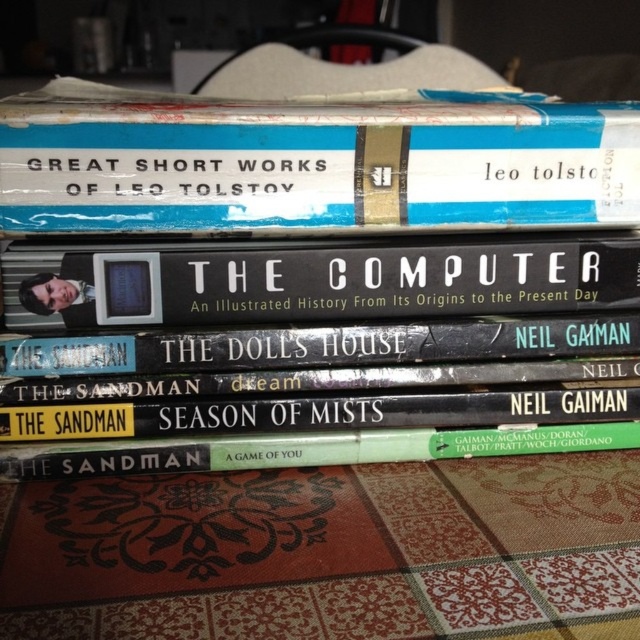
Question: Among these points, which one is nearest to the camera?

Choices:
 (A) (83, 145)
 (B) (376, 298)
 (C) (612, 237)

Answer: (A)

Question: Can you confirm if blue hardcover book at upper center is bigger than green matte book at center?

Choices:
 (A) no
 (B) yes

Answer: (B)

Question: Considering the relative positions of blue hardcover book at upper center and black hardcover book at center in the image provided, where is blue hardcover book at upper center located with respect to black hardcover book at center?

Choices:
 (A) right
 (B) left

Answer: (B)

Question: Estimate the real-world distances between objects in this image. Which object is farther from the blue hardcover book at upper center?

Choices:
 (A) hardcover book at center
 (B) green matte book at center

Answer: (B)

Question: Which of these objects is positioned farthest from the blue hardcover book at upper center?

Choices:
 (A) black hardcover book at center
 (B) hardcover book at center

Answer: (A)

Question: Does hardcover book at center have a greater width compared to blue hardcover book at upper center?

Choices:
 (A) no
 (B) yes

Answer: (A)